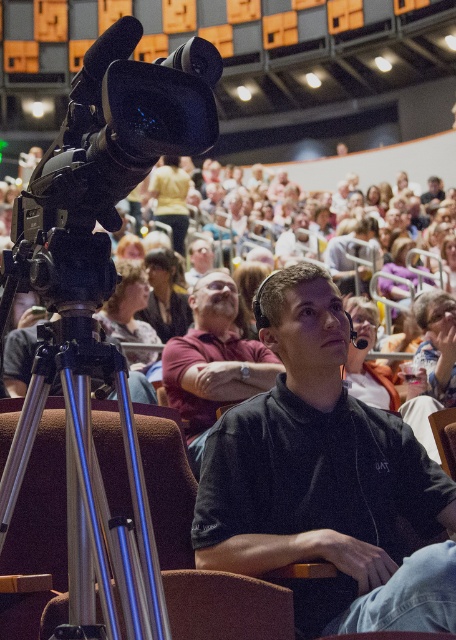
Locate an element on the screen. The width and height of the screenshot is (456, 640). silver metallic tripod at left is located at coordinates (87, 442).

Who is higher up, silver metallic tripod at left or dark red shirt at center?

silver metallic tripod at left is higher up.

Is point (76, 291) in front of point (255, 385)?

Yes, point (76, 291) is in front of point (255, 385).

You are a GUI agent. You are given a task and a screenshot of the screen. Output one action in this format:
    pyautogui.click(x=<x>, y=<y>)
    Task: Click on the silver metallic tripod at left
    
    Given the screenshot: What is the action you would take?
    [87, 442]

Who is shorter, black matte shirt at center or dark brown hair at center?

Standing shorter between the two is black matte shirt at center.

Does point (335, 420) lie in front of point (138, 316)?

That is True.

Where is `black matte shirt at center`? black matte shirt at center is located at coordinates (325, 481).

At what (x,y) coordinates should I click in order to perform the action: click on black matte shirt at center. Please return your answer as a coordinate pair (x, y). Looking at the image, I should click on (325, 481).

How distant is black matte shirt at center from silver metallic tripod at left?

black matte shirt at center is 23.34 feet away from silver metallic tripod at left.

Does black matte shirt at center have a larger size compared to silver metallic tripod at left?

Incorrect, black matte shirt at center is not larger than silver metallic tripod at left.

You are a GUI agent. You are given a task and a screenshot of the screen. Output one action in this format:
    pyautogui.click(x=<x>, y=<y>)
    Task: Click on the black matte shirt at center
    Image resolution: width=456 pixels, height=640 pixels.
    Given the screenshot: What is the action you would take?
    pyautogui.click(x=325, y=481)